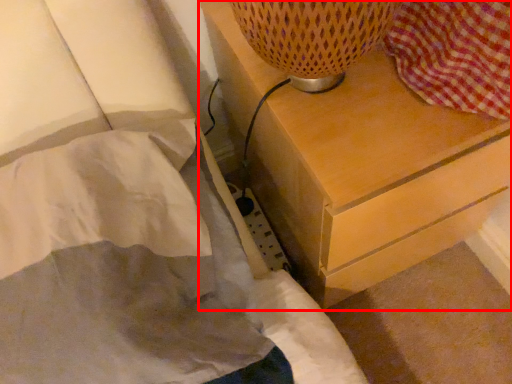
Question: Where is chest of drawers (annotated by the red box) located in relation to bed in the image?

Choices:
 (A) left
 (B) right

Answer: (B)